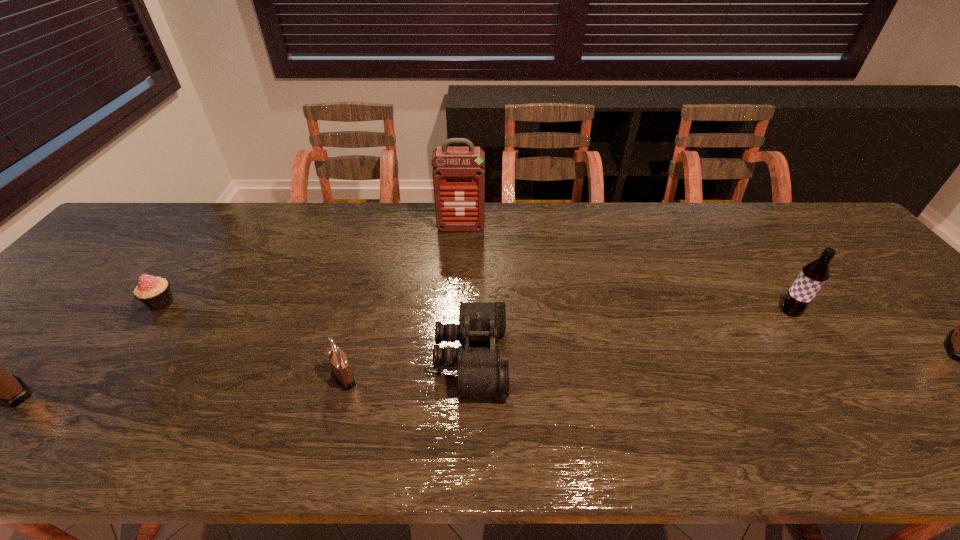
Where is `vacant space in between the fifth tallest object and the cupcake`? The width and height of the screenshot is (960, 540). vacant space in between the fifth tallest object and the cupcake is located at coordinates (252, 340).

Find the location of `free space between the root beer and the fifth object from right to left`. free space between the root beer and the fifth object from right to left is located at coordinates (567, 343).

Find the location of a particular element. This screenshot has height=540, width=960. blank region between the root beer and the farthest object is located at coordinates (626, 269).

This screenshot has width=960, height=540. Identify the location of free space between the third object from left to right and the binoculars. (408, 367).

You are a GUI agent. You are given a task and a screenshot of the screen. Output one action in this format:
    pyautogui.click(x=<x>, y=<y>)
    Task: Click on the vacant area that lies between the shortest padlock and the root beer
    The image size is (960, 540).
    Given the screenshot: What is the action you would take?
    pyautogui.click(x=567, y=343)

Select which object is the fifth closest to the leftmost padlock. Please provide its 2D coordinates. Your answer should be formatted as a tuple, i.e. [(x, y)], where the tuple contains the x and y coordinates of a point satisfying the conditions above.

[(812, 277)]

Point out which object is positioned as the sixth nearest to the second padlock from left to right. Please provide its 2D coordinates. Your answer should be formatted as a tuple, i.e. [(x, y)], where the tuple contains the x and y coordinates of a point satisfying the conditions above.

[(959, 343)]

Identify which padlock is the closest to the leftmost object. Please provide its 2D coordinates. Your answer should be formatted as a tuple, i.e. [(x, y)], where the tuple contains the x and y coordinates of a point satisfying the conditions above.

[(343, 374)]

This screenshot has width=960, height=540. I want to click on the second closest padlock relative to the rightmost object, so click(x=0, y=387).

Find the location of a particular element. The width and height of the screenshot is (960, 540). vacant space that satisfies the following two spatial constraints: 1. on the front-facing side of the sixth object from left to right; 2. on the left side of the farthest object is located at coordinates (457, 310).